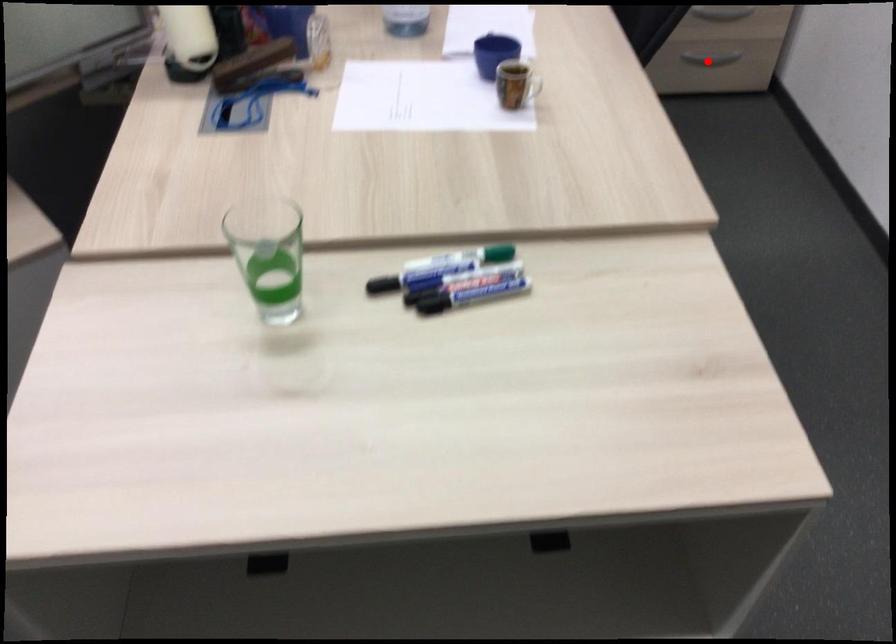
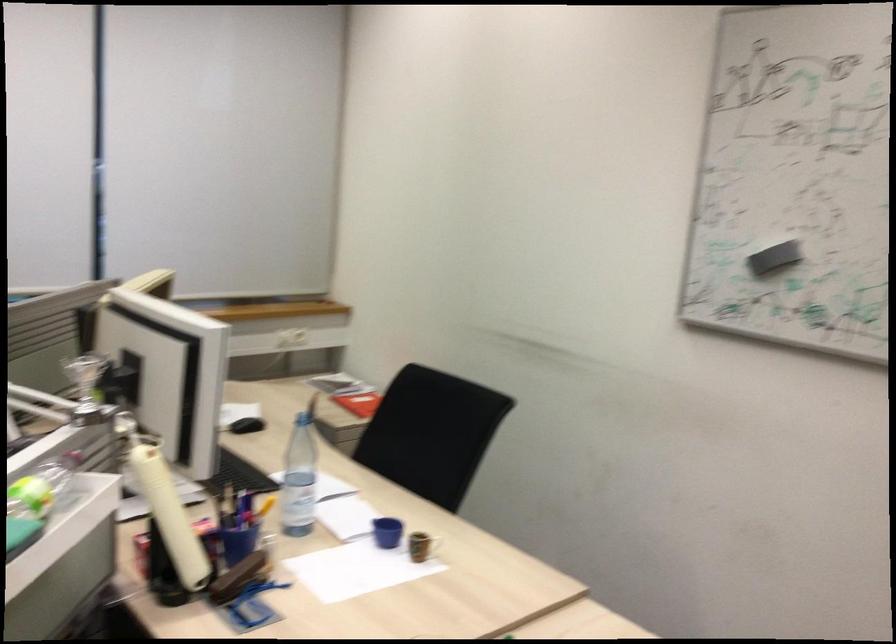
Question: I am providing you with two images of the same scene from different viewpoints. A red point is marked on the first image. At the location where the point appears in image 1, is it still visible in image 2?

Choices:
 (A) Yes
 (B) No

Answer: (B)